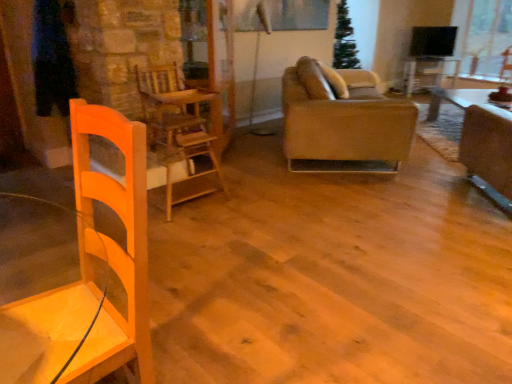
Question: Is the depth of leather couch at center greater than that of wooden table at center?

Choices:
 (A) yes
 (B) no

Answer: (B)

Question: Does leather couch at center have a greater width compared to wooden table at center?

Choices:
 (A) yes
 (B) no

Answer: (A)

Question: Is leather couch at center positioned with its back to wooden table at center?

Choices:
 (A) no
 (B) yes

Answer: (A)

Question: Is leather couch at center beside wooden table at center?

Choices:
 (A) no
 (B) yes

Answer: (A)

Question: Does leather couch at center have a greater height compared to wooden table at center?

Choices:
 (A) no
 (B) yes

Answer: (B)

Question: Is leather couch at center outside of wooden table at center?

Choices:
 (A) yes
 (B) no

Answer: (A)

Question: Is wooden table at center closer to the viewer compared to leather couch at center?

Choices:
 (A) yes
 (B) no

Answer: (B)

Question: Would you say wooden table at center contains leather couch at center?

Choices:
 (A) no
 (B) yes

Answer: (A)

Question: Is wooden table at center thinner than leather couch at center?

Choices:
 (A) no
 (B) yes

Answer: (B)

Question: From a real-world perspective, does wooden table at center sit lower than leather couch at center?

Choices:
 (A) no
 (B) yes

Answer: (B)

Question: Considering the relative positions of wooden table at center and leather couch at center in the image provided, is wooden table at center to the right of leather couch at center from the viewer's perspective?

Choices:
 (A) yes
 (B) no

Answer: (A)

Question: Is wooden table at center taller than leather couch at center?

Choices:
 (A) yes
 (B) no

Answer: (B)

Question: Is matte glass window screen at upper center taller than wooden chair at center?

Choices:
 (A) yes
 (B) no

Answer: (B)